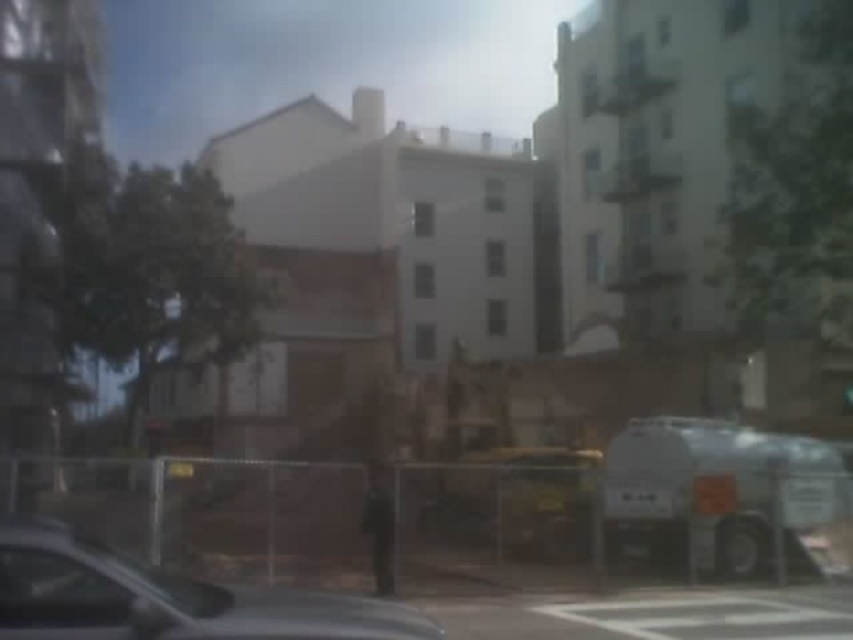
Which is more to the left, metallic silver car at lower left or white matte truck at lower right?

From the viewer's perspective, metallic silver car at lower left appears more on the left side.

Image resolution: width=853 pixels, height=640 pixels. In order to click on metallic silver car at lower left in this screenshot , I will do `click(165, 598)`.

The width and height of the screenshot is (853, 640). What are the coordinates of `metallic silver car at lower left` in the screenshot? It's located at (165, 598).